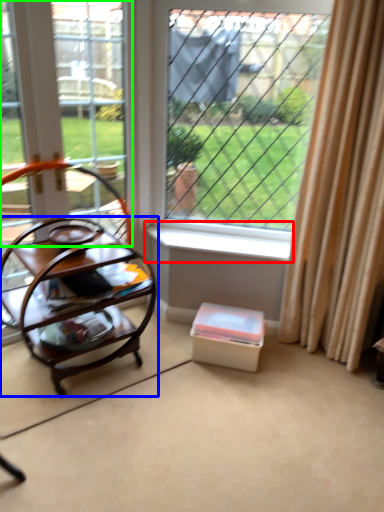
Question: Considering the real-world distances, which object is closest to window sill (highlighted by a red box)? table (highlighted by a blue box) or window frame (highlighted by a green box).

Choices:
 (A) table
 (B) window frame

Answer: (A)